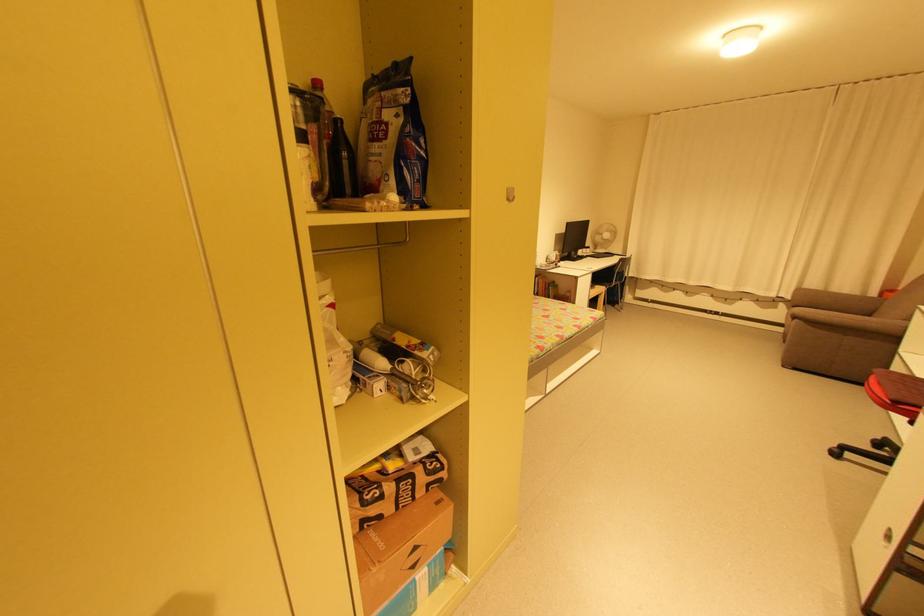
Find the location of a particular element. This screenshot has height=616, width=924. white handheld blender is located at coordinates (602, 237).